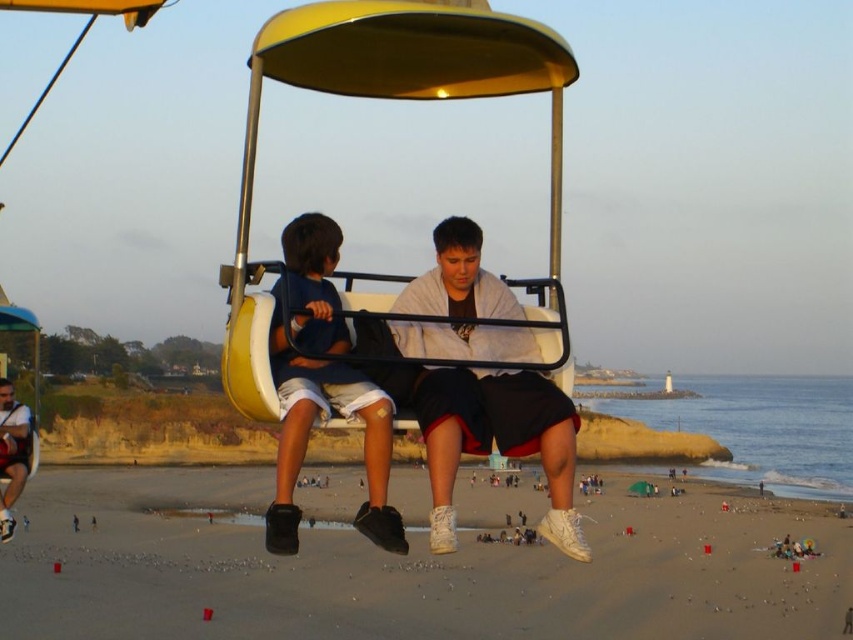
Question: From the image, what is the correct spatial relationship of sandy beach at lower center in relation to gray cotton hoodie at center?

Choices:
 (A) below
 (B) above

Answer: (A)

Question: Based on their relative distances, which object is farther from the yellow matte golf cart at center?

Choices:
 (A) matte black shorts at center
 (B) matte white t-shirt at lower left

Answer: (B)

Question: Estimate the real-world distances between objects in this image. Which object is farther from the sandy beach at lower center?

Choices:
 (A) matte white t-shirt at lower left
 (B) matte black shorts at center
 (C) gray cotton hoodie at center
 (D) yellow matte golf cart at center

Answer: (C)

Question: Is yellow matte golf cart at center further to the viewer compared to matte white t-shirt at lower left?

Choices:
 (A) no
 (B) yes

Answer: (A)

Question: Does sandy beach at lower center appear under matte black shorts at center?

Choices:
 (A) yes
 (B) no

Answer: (A)

Question: Which point is farther to the camera?

Choices:
 (A) (468, 221)
 (B) (3, 540)
 (C) (630, 609)
 (D) (369, 435)

Answer: (C)